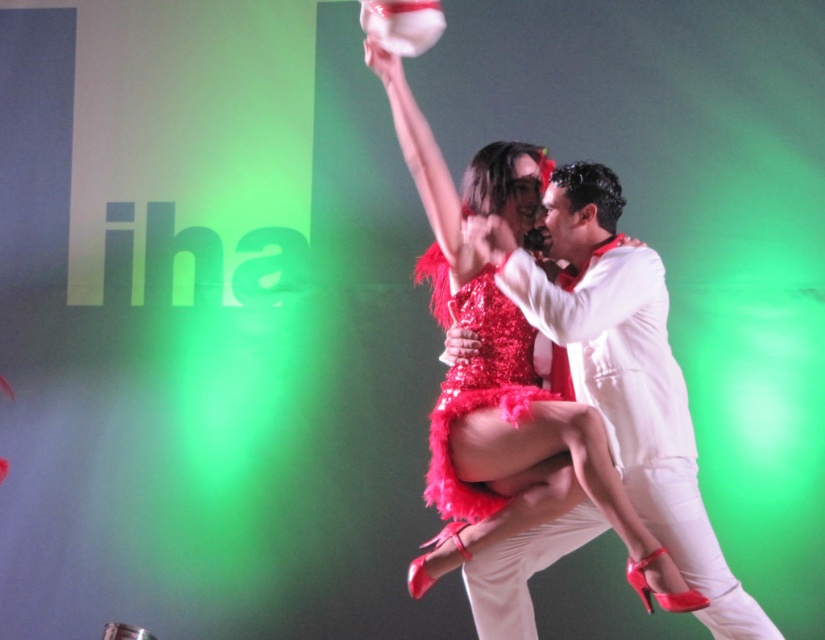
Can you confirm if white satin suit at center is shorter than shiny sequined dress at center?

No, white satin suit at center is not shorter than shiny sequined dress at center.

Is white satin suit at center smaller than shiny sequined dress at center?

No, white satin suit at center is not smaller than shiny sequined dress at center.

Image resolution: width=825 pixels, height=640 pixels. What do you see at coordinates (621, 371) in the screenshot?
I see `white satin suit at center` at bounding box center [621, 371].

Identify the location of white satin suit at center. The height and width of the screenshot is (640, 825). (621, 371).